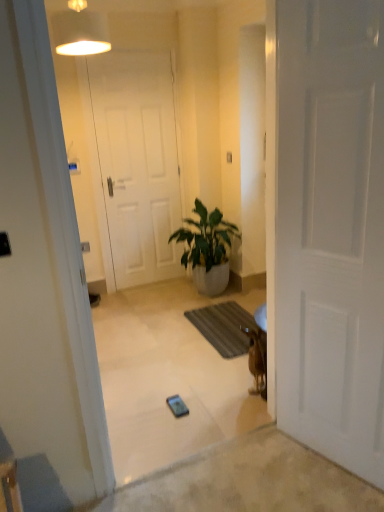
Locate an element on the screen. blank space above brown textured mat at lower center (from a real-world perspective) is located at coordinates (222, 318).